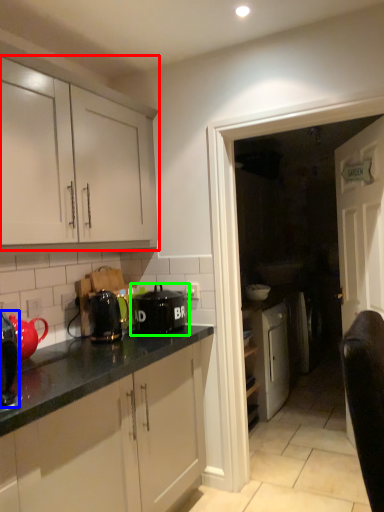
Question: Considering the real-world distances, which object is farthest from cabinetry (highlighted by a red box)? kitchen appliance (highlighted by a blue box) or kitchen appliance (highlighted by a green box)?

Choices:
 (A) kitchen appliance
 (B) kitchen appliance

Answer: (A)